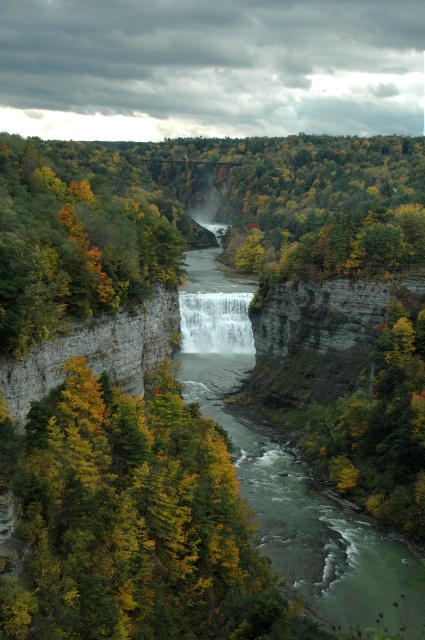
You are standing at point (124, 355) and want to reach the waterfall. Which direction should you move to get closer to the waterfall, considering the location of point (258, 476)?

Since point (258, 476) is behind point (124, 355), you should move towards point (258, 476) to get closer to the waterfall.

You are standing at the origin point of the image coordinate system, which is the bottom left corner. You want to take a photo of the gray rocky cliff at center. In which direction should you move to position yourself directly in front of it?

The gray rocky cliff at center is located at point (x=96, y=352) in the image coordinate system. Since the origin is at the bottom left corner, you should move to the right and slightly upward to align yourself directly in front of it.

From the picture: You are standing at the edge of the cliff overlooking the waterfall. You want to cross the river using a small boat that can only navigate calm waters. Based on the scene description, is the green smooth river at center a suitable place to launch your boat?

The green smooth river at center is suitable for launching the boat because it is described as smooth, indicating calm waters that can accommodate a small boat.